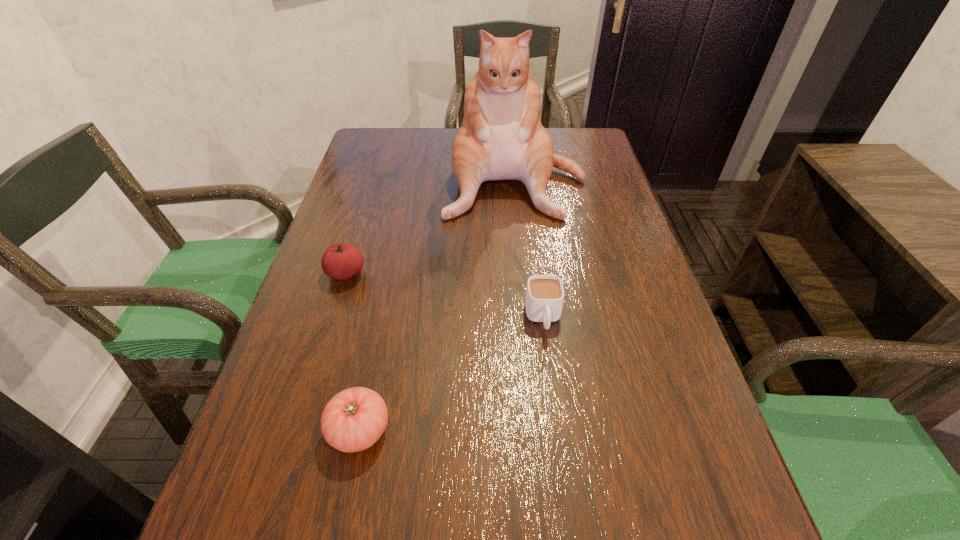
Locate an element on the screen. This screenshot has width=960, height=540. free space located 0.130m on the side with the handle of the cup is located at coordinates (554, 399).

Identify the location of object that is at the far edge. (501, 137).

Locate an element on the screen. object that is positioned at the right edge is located at coordinates (501, 137).

Identify the location of object at the far right corner. The height and width of the screenshot is (540, 960). 501,137.

The height and width of the screenshot is (540, 960). In order to click on vacant space at the left edge of the desktop in this screenshot , I will do `click(304, 371)`.

Locate an element on the screen. free space at the right edge is located at coordinates (619, 240).

Where is `blank area at the far left corner`? blank area at the far left corner is located at coordinates (396, 134).

What are the coordinates of `free area in between the nearest object and the second nearest object` in the screenshot? It's located at (451, 374).

This screenshot has height=540, width=960. Find the location of `free spot between the nearest object and the cup`. free spot between the nearest object and the cup is located at coordinates (451, 374).

I want to click on free space that is in between the third farthest object and the cat, so click(529, 248).